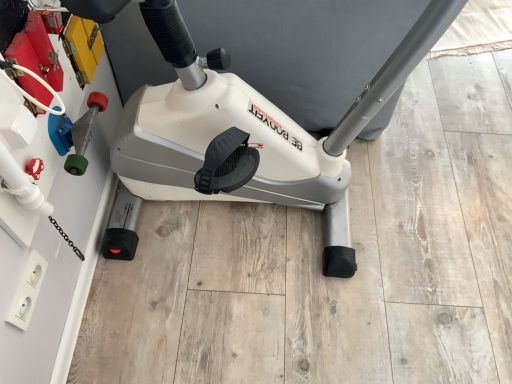
Locate an element on the screen. The height and width of the screenshot is (384, 512). vacant area situated below white matte stationary bicycle at center (from a real-world perspective) is located at coordinates (262, 221).